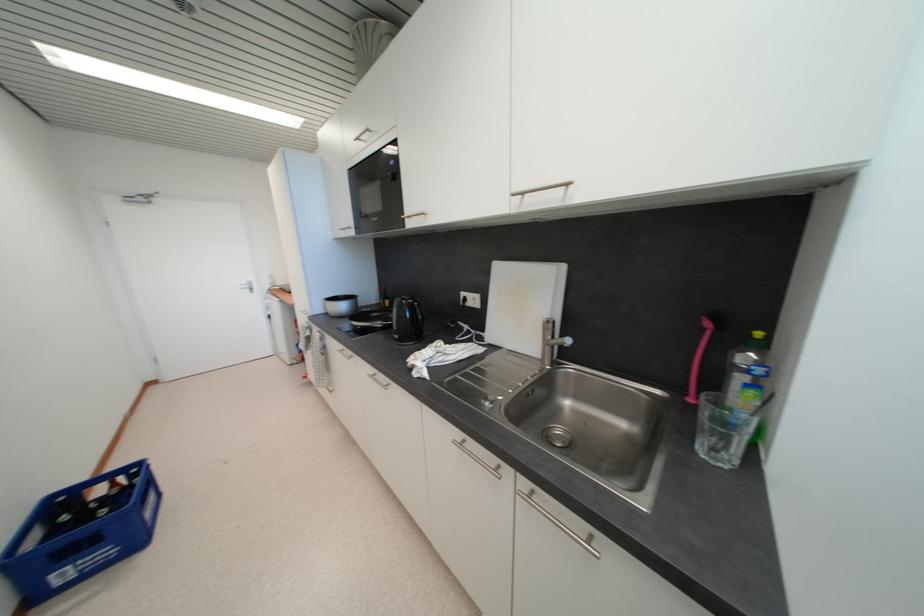
Identify the location of dish soap bottle. The image size is (924, 616). (748, 376).